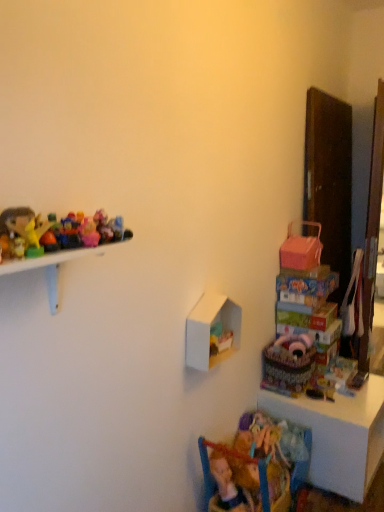
Question: Is textured fabric basket at lower right at the back of white matte shelf at center?

Choices:
 (A) yes
 (B) no

Answer: (B)

Question: Considering the relative sizes of white matte shelf at center and textured fabric basket at lower right in the image provided, is white matte shelf at center taller than textured fabric basket at lower right?

Choices:
 (A) yes
 (B) no

Answer: (B)

Question: Can you confirm if white matte shelf at center is shorter than textured fabric basket at lower right?

Choices:
 (A) no
 (B) yes

Answer: (B)

Question: Does white matte shelf at center have a greater width compared to textured fabric basket at lower right?

Choices:
 (A) no
 (B) yes

Answer: (A)

Question: Is white matte shelf at center with textured fabric basket at lower right?

Choices:
 (A) yes
 (B) no

Answer: (B)

Question: Does white matte shelf at center have a larger size compared to textured fabric basket at lower right?

Choices:
 (A) no
 (B) yes

Answer: (A)

Question: Considering the relative positions of white matte shelf at center and shiny plastic toys at left, which is the 2th toy from top to bottom, in the image provided, is white matte shelf at center in front of shiny plastic toys at left, which is the 2th toy from top to bottom,?

Choices:
 (A) no
 (B) yes

Answer: (A)

Question: Considering the relative sizes of white matte shelf at center and shiny plastic toys at left, the fourth toy in the back-to-front sequence, in the image provided, is white matte shelf at center smaller than shiny plastic toys at left, the fourth toy in the back-to-front sequence,?

Choices:
 (A) yes
 (B) no

Answer: (B)

Question: From the image's perspective, is white matte shelf at center located above shiny plastic toys at left, which ranks as the 1th toy in left-to-right order?

Choices:
 (A) yes
 (B) no

Answer: (B)

Question: Does white matte shelf at center appear on the left side of shiny plastic toys at left, which ranks as the 1th toy in left-to-right order?

Choices:
 (A) no
 (B) yes

Answer: (A)

Question: Considering the relative sizes of white matte shelf at center and shiny plastic toys at left, the fourth toy in the back-to-front sequence, in the image provided, is white matte shelf at center thinner than shiny plastic toys at left, the fourth toy in the back-to-front sequence,?

Choices:
 (A) no
 (B) yes

Answer: (A)

Question: Is white matte shelf at center facing away from shiny plastic toys at left, which ranks as the 1th toy in left-to-right order?

Choices:
 (A) no
 (B) yes

Answer: (A)

Question: Is translucent plastic toys at upper left, the third toy positioned from the back, oriented away from white matte shelf at center?

Choices:
 (A) yes
 (B) no

Answer: (B)